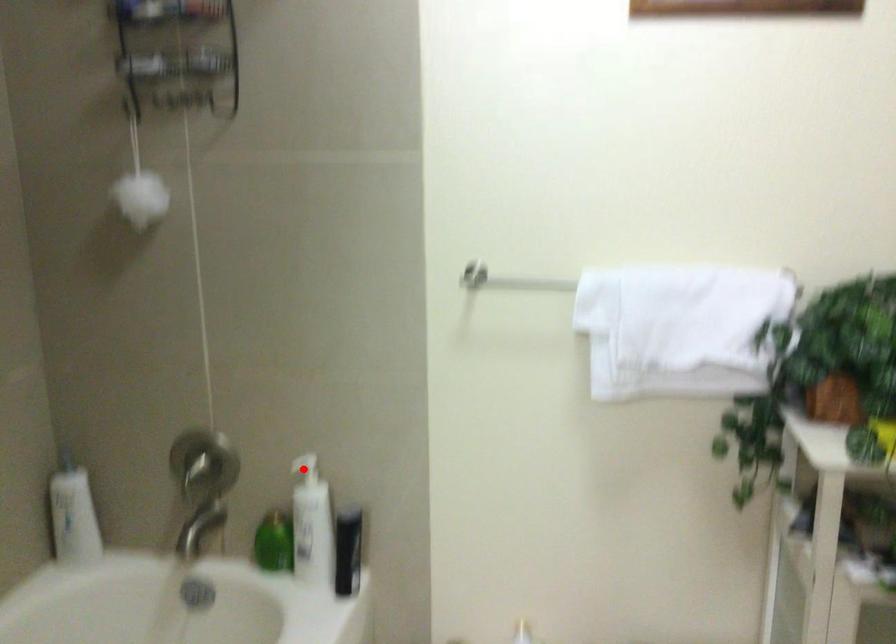
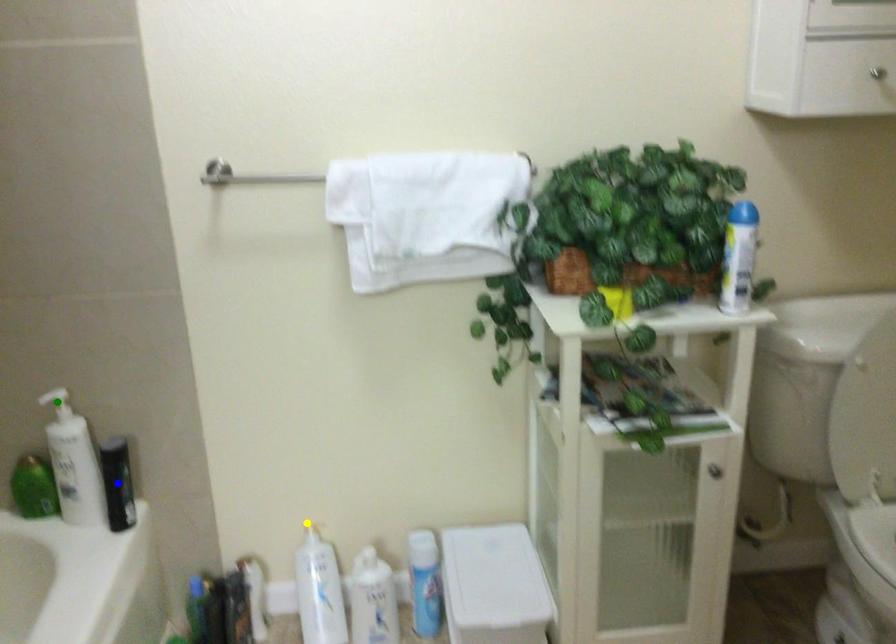
Question: I am providing you with two images of the same scene from different viewpoints. A red point is marked on the first image. You are given multiple points on the second image. Can you choose the point in image 2 that corresponds to the point in image 1?

Choices:
 (A) green point
 (B) blue point
 (C) yellow point

Answer: (A)